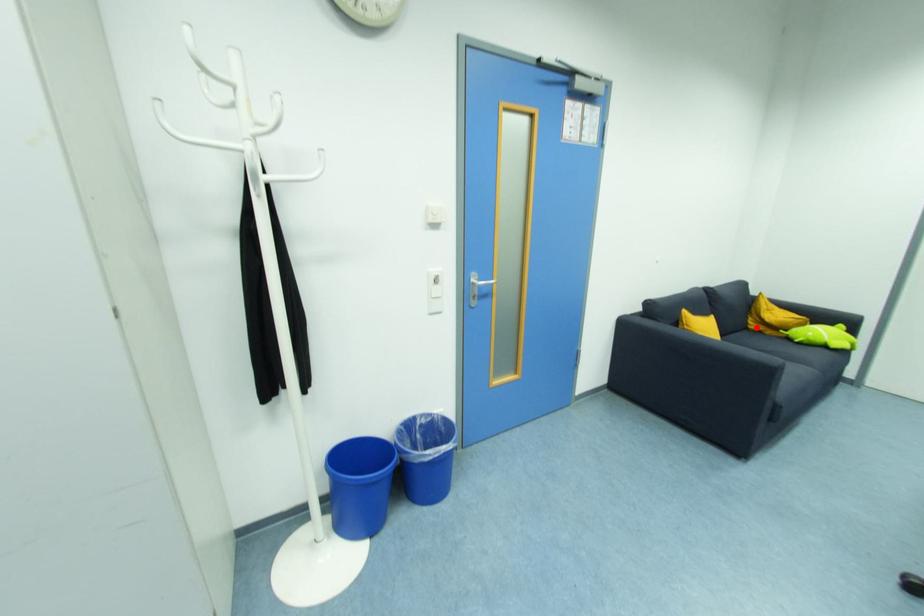
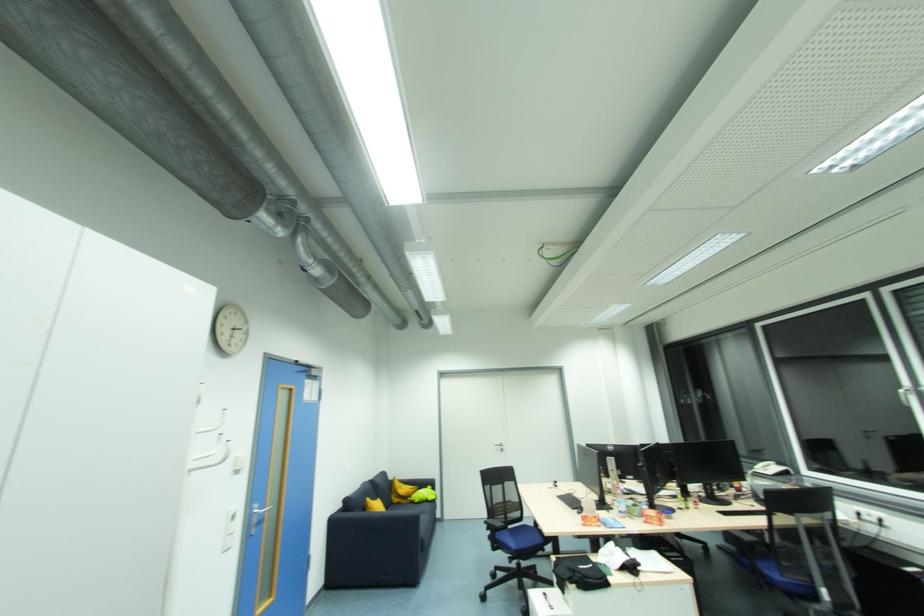
Question: I am providing you with two images of the same scene from different viewpoints. Given a red point in image1, look at the same physical point in image2. Is it:

Choices:
 (A) Closer to the viewpoint
 (B) Farther from the viewpoint

Answer: (B)